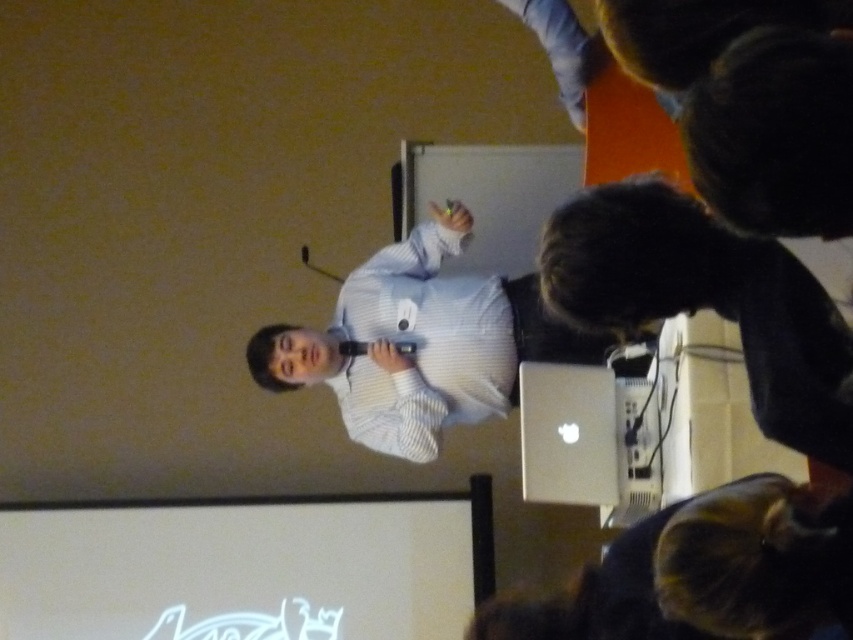
Question: Which point is closer to the camera?

Choices:
 (A) white striped shirt at center
 (B) silver metallic laptop at lower right

Answer: (B)

Question: Can you confirm if silver metallic laptop at lower right is positioned below white striped shirt at center?

Choices:
 (A) yes
 (B) no

Answer: (B)

Question: Can you confirm if silver metallic laptop at lower right is positioned below white striped shirt at center?

Choices:
 (A) no
 (B) yes

Answer: (A)

Question: Which point appears farthest from the camera in this image?

Choices:
 (A) (425, 308)
 (B) (636, 216)

Answer: (A)

Question: Does silver metallic laptop at lower right appear on the right side of white striped shirt at center?

Choices:
 (A) yes
 (B) no

Answer: (A)